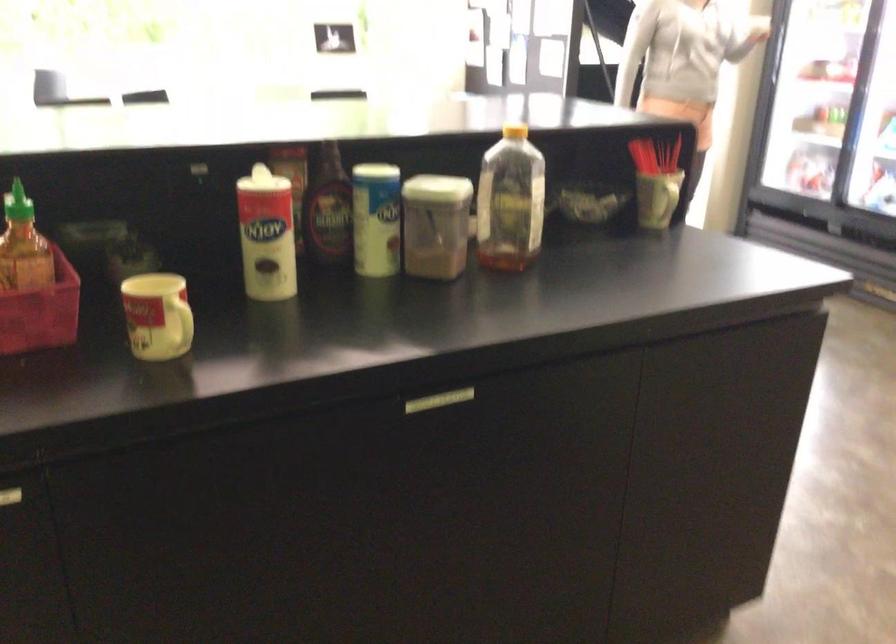
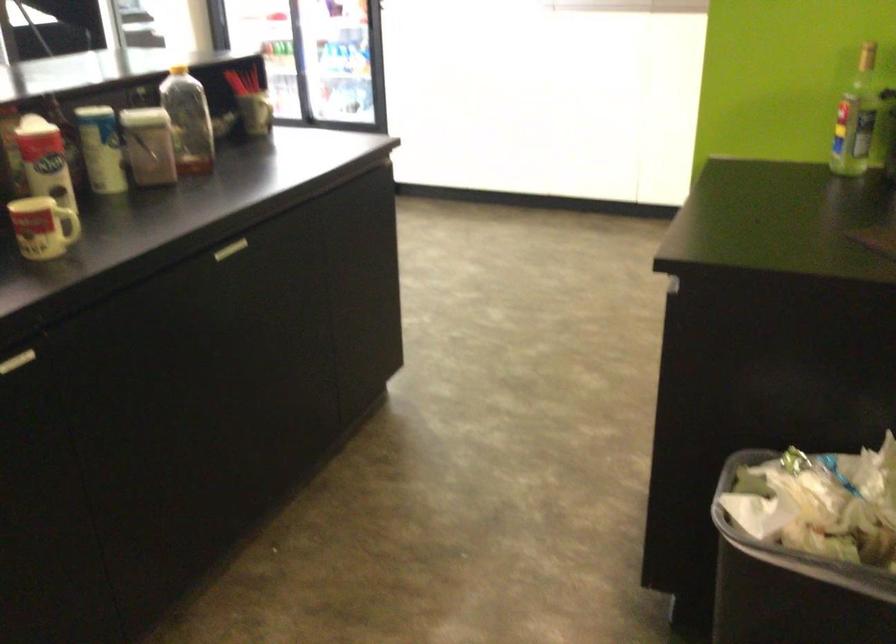
In the second image, find the point that corresponds to (495,192) in the first image.

(187, 120)